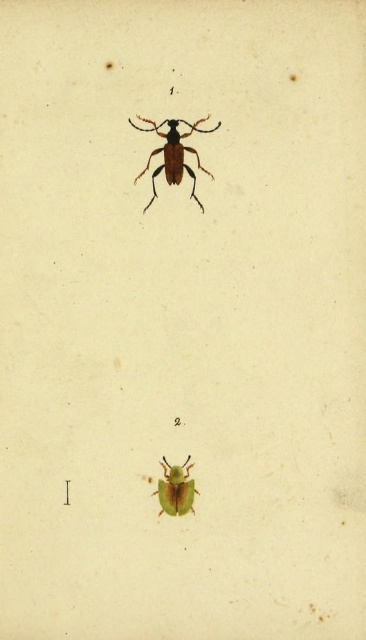
Does matte brown beetle at upper center appear on the left side of green matte beetle at lower center?

Indeed, matte brown beetle at upper center is positioned on the left side of green matte beetle at lower center.

Which of these two, matte brown beetle at upper center or green matte beetle at lower center, stands taller?

With more height is matte brown beetle at upper center.

Does point (196, 129) lie behind point (192, 513)?

No, (196, 129) is closer to viewer.

Image resolution: width=366 pixels, height=640 pixels. Identify the location of matte brown beetle at upper center. (173, 154).